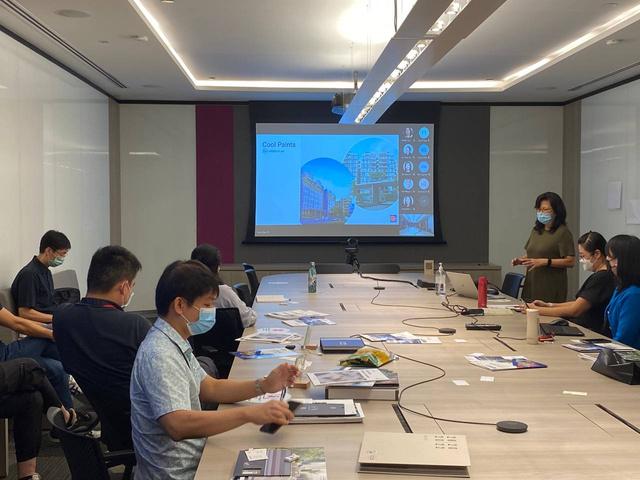
Image resolution: width=640 pixels, height=480 pixels. In order to click on books in this screenshot , I will do `click(291, 472)`, `click(322, 399)`, `click(362, 368)`, `click(331, 351)`, `click(291, 316)`, `click(306, 457)`.